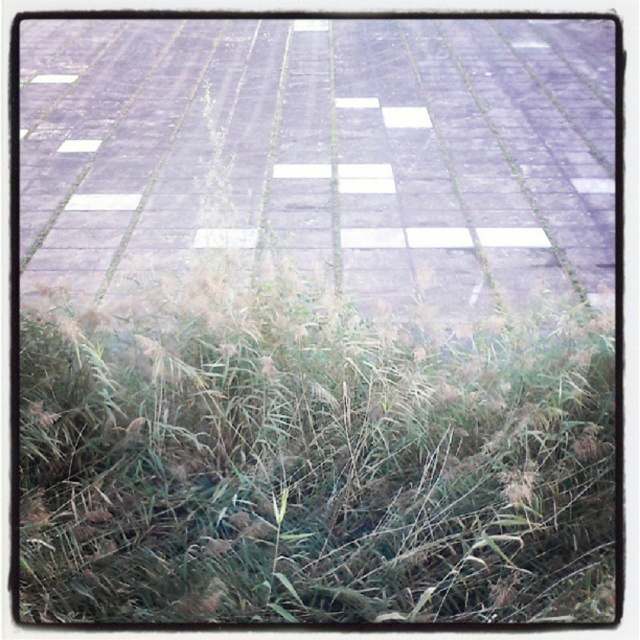
Question: Can you confirm if green grass at lower left is positioned to the left of gray concrete pavement at center?

Choices:
 (A) yes
 (B) no

Answer: (B)

Question: Can you confirm if green grass at lower left is bigger than gray concrete pavement at center?

Choices:
 (A) no
 (B) yes

Answer: (A)

Question: Can you confirm if green grass at lower left is positioned to the left of gray concrete pavement at center?

Choices:
 (A) no
 (B) yes

Answer: (A)

Question: Which object appears farthest from the camera in this image?

Choices:
 (A) green grass at lower left
 (B) gray concrete pavement at center

Answer: (B)